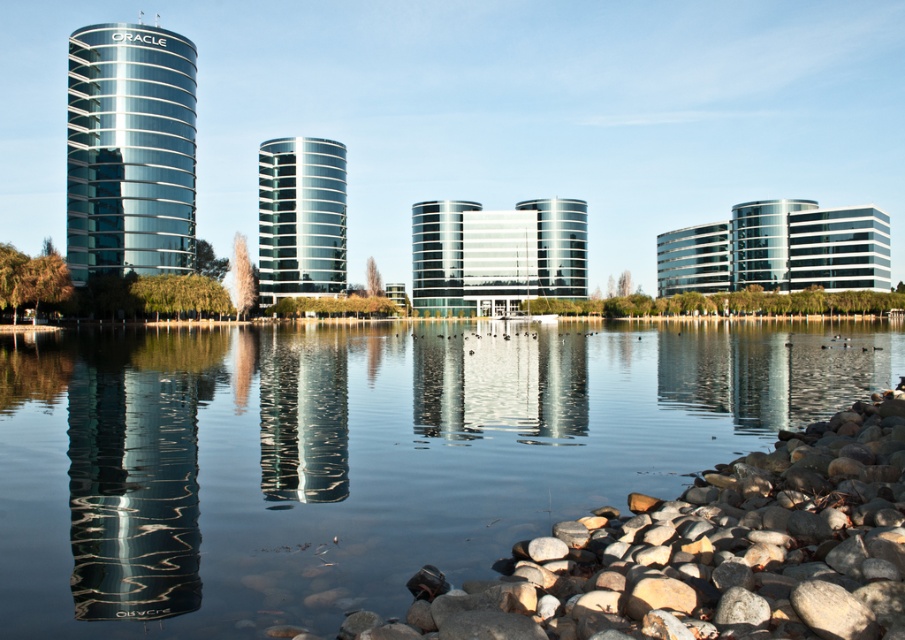
Question: Can you confirm if transparent water at center is wider than glossy glass building at left?

Choices:
 (A) yes
 (B) no

Answer: (A)

Question: Which point appears closest to the camera in this image?

Choices:
 (A) (751, 474)
 (B) (437, 513)

Answer: (B)

Question: Considering the real-world distances, which object is closest to the glossy glass tower at center?

Choices:
 (A) transparent water at center
 (B) glossy glass tower at left

Answer: (B)

Question: Based on their relative distances, which object is farther from the glossy glass tower at center?

Choices:
 (A) glossy glass building at left
 (B) glossy glass tower at left
 (C) transparent water at center
 (D) smooth gray rock at lower right

Answer: (D)

Question: Is smooth gray rock at lower right positioned at the back of glossy glass tower at center?

Choices:
 (A) yes
 (B) no

Answer: (B)

Question: Is smooth gray rock at lower right positioned in front of glossy glass tower at left?

Choices:
 (A) yes
 (B) no

Answer: (A)